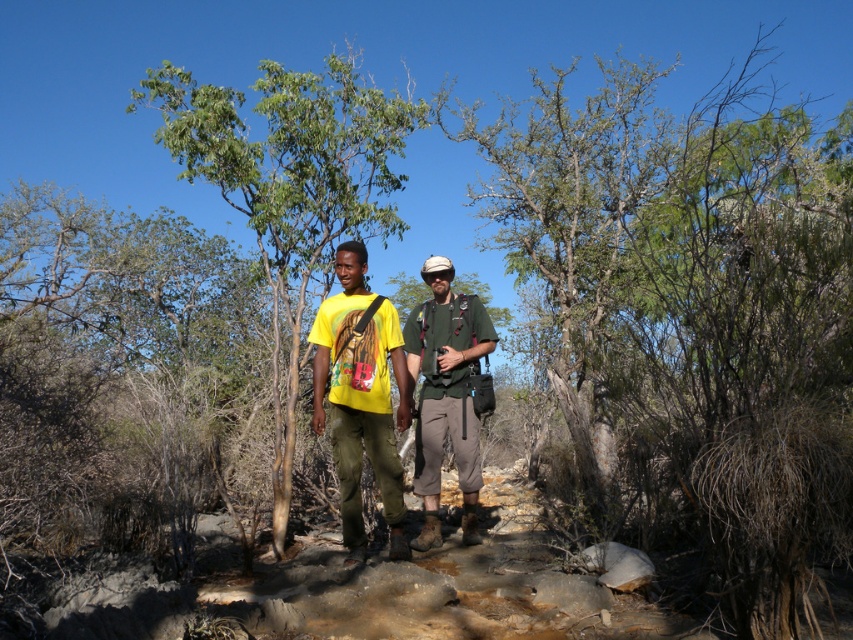
You are a hiker trying to take a photo of the green leafy tree at center and the green fabric shirt at center. Which object will appear larger in the photo?

The green leafy tree at center will appear larger in the photo because it is much taller than the green fabric shirt at center.